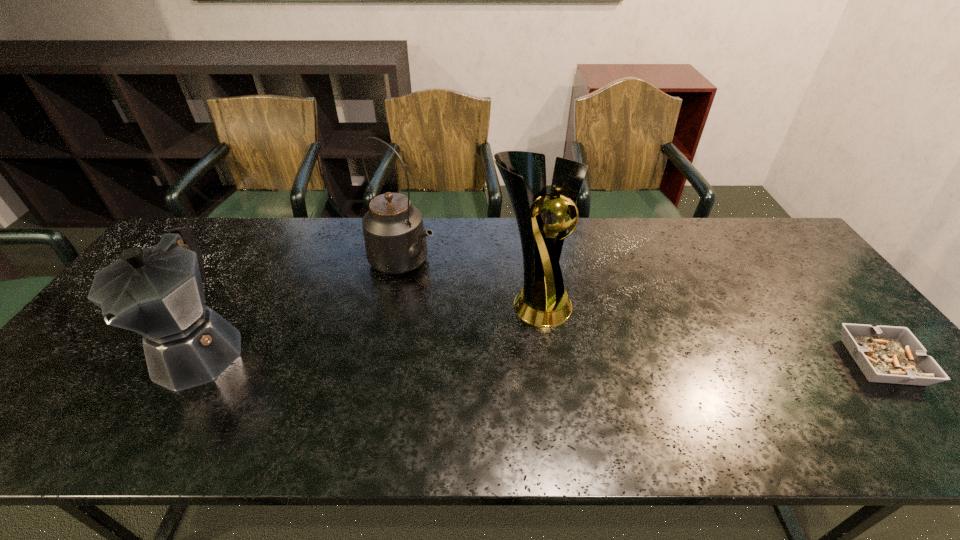
You are a GUI agent. You are given a task and a screenshot of the screen. Output one action in this format:
    pyautogui.click(x=<x>, y=<y>)
    Task: Click on the vacant space located spout on the third object from right to left
    This screenshot has height=540, width=960.
    Given the screenshot: What is the action you would take?
    pyautogui.click(x=533, y=342)

This screenshot has height=540, width=960. I want to click on free location located 0.290m at the front of the third object from left to right, where the globe is visible, so click(675, 382).

You are a GUI agent. You are given a task and a screenshot of the screen. Output one action in this format:
    pyautogui.click(x=<x>, y=<y>)
    Task: Click on the vacant area situated at the front of the third object from left to right, where the globe is visible
    
    Given the screenshot: What is the action you would take?
    pyautogui.click(x=638, y=362)

Locate an element on the screen. free spot located at the front of the third object from left to right, where the globe is visible is located at coordinates (636, 360).

What are the coordinates of `object that is positioned at the far edge` in the screenshot? It's located at (395, 240).

This screenshot has width=960, height=540. I want to click on coffeepot at the near edge, so click(x=157, y=292).

What are the coordinates of `ashtray located at the near edge` in the screenshot? It's located at (886, 354).

The height and width of the screenshot is (540, 960). I want to click on object that is positioned at the right edge, so click(x=886, y=354).

What are the coordinates of `object situated at the near right corner` in the screenshot? It's located at (886, 354).

Where is `free region at the far edge`? This screenshot has width=960, height=540. free region at the far edge is located at coordinates (493, 244).